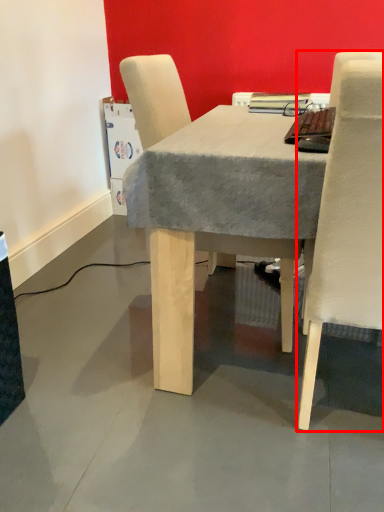
Question: From the image's perspective, considering the relative positions of chair (annotated by the red box) and chair in the image provided, where is chair (annotated by the red box) located with respect to the staircase?

Choices:
 (A) above
 (B) below

Answer: (B)